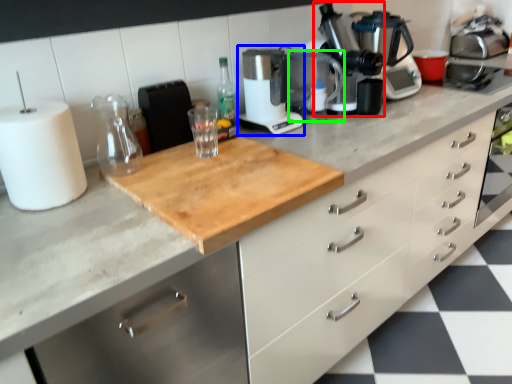
Question: Which is farther away from coffee machine (highlighted by a red box)? kitchen appliance (highlighted by a blue box) or appliance (highlighted by a green box)?

Choices:
 (A) kitchen appliance
 (B) appliance

Answer: (A)